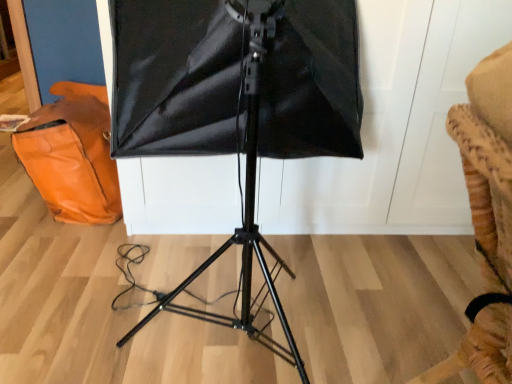
Question: Should I look upward or downward to see orange leather messenger bag at left?

Choices:
 (A) down
 (B) up

Answer: (B)